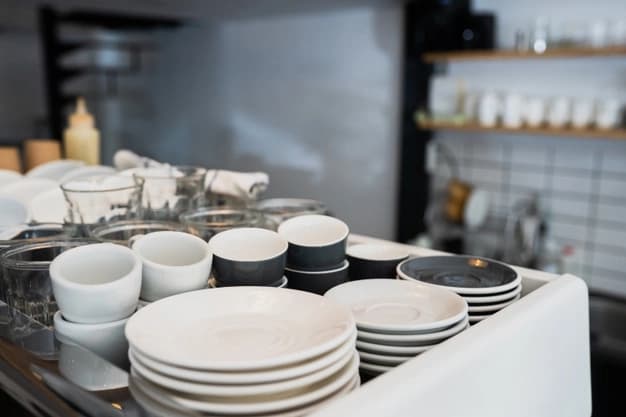
Find the location of a particular element. This screenshot has width=626, height=417. blue plate is located at coordinates (481, 275), (481, 299), (483, 308), (475, 319).